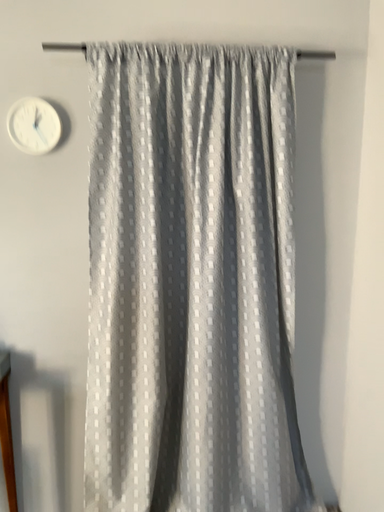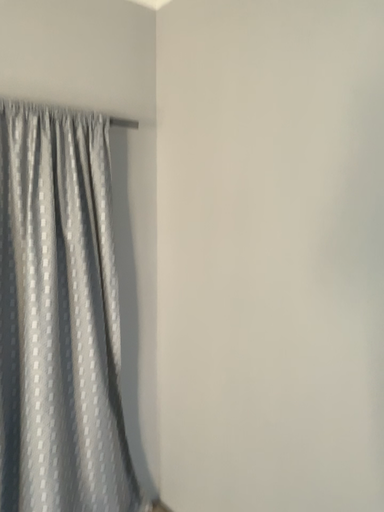
Question: Which way did the camera rotate in the video?

Choices:
 (A) rotated right
 (B) rotated left

Answer: (A)